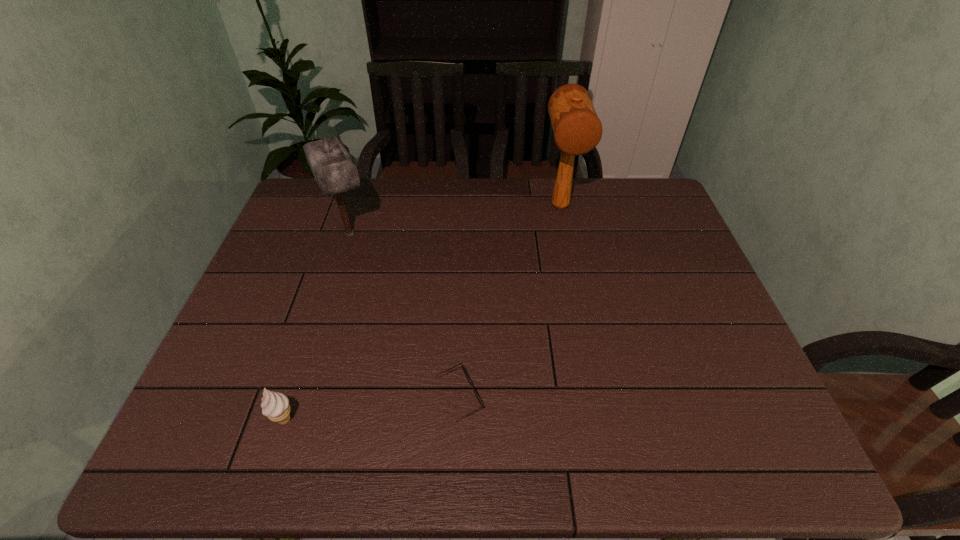
At what (x,y) coordinates should I click in order to perform the action: click on the rightmost object. Please return your answer as a coordinate pair (x, y). The height and width of the screenshot is (540, 960). Looking at the image, I should click on (577, 129).

Where is `the left mallet`? This screenshot has width=960, height=540. the left mallet is located at coordinates (335, 171).

Where is `icecream`? The height and width of the screenshot is (540, 960). icecream is located at coordinates (275, 406).

The image size is (960, 540). I want to click on spectacles, so click(463, 369).

Where is `the third object from left to right`? the third object from left to right is located at coordinates (463, 369).

Identify the location of vacant region located 0.270m on the strike surface of the right mallet. The image size is (960, 540). (578, 291).

Locate an element on the screen. vacant space located 0.060m on the right of the left mallet is located at coordinates (396, 233).

In order to click on free region located on the front-facing side of the third tallest object in this screenshot , I will do `click(325, 420)`.

This screenshot has width=960, height=540. I want to click on vacant space situated with the lenses facing outward on the third object from left to right, so click(529, 397).

Locate an element on the screen. icecream that is at the near edge is located at coordinates (275, 406).